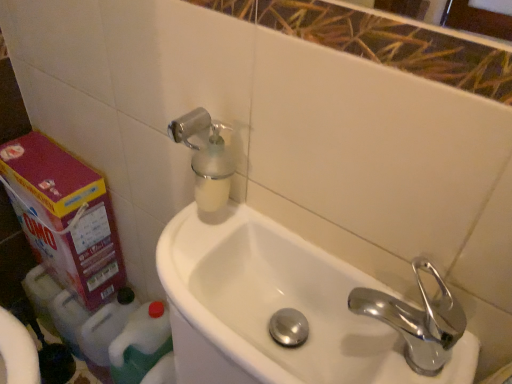
Question: Is translucent plastic soap dispenser at upper left facing away from chrome metallic faucet at right?

Choices:
 (A) no
 (B) yes

Answer: (A)

Question: Is the surface of translucent plastic soap dispenser at upper left in direct contact with chrome metallic faucet at right?

Choices:
 (A) yes
 (B) no

Answer: (B)

Question: From the image's perspective, would you say translucent plastic soap dispenser at upper left is shown under chrome metallic faucet at right?

Choices:
 (A) no
 (B) yes

Answer: (A)

Question: Is translucent plastic soap dispenser at upper left shorter than chrome metallic faucet at right?

Choices:
 (A) no
 (B) yes

Answer: (A)

Question: Is translucent plastic soap dispenser at upper left outside of chrome metallic faucet at right?

Choices:
 (A) no
 (B) yes

Answer: (B)

Question: From a real-world perspective, is translucent plastic soap dispenser at upper left below chrome metallic faucet at right?

Choices:
 (A) yes
 (B) no

Answer: (B)

Question: Could you tell me if chrome metallic faucet at right is facing pink cardboard carton at left?

Choices:
 (A) no
 (B) yes

Answer: (A)

Question: From the image's perspective, is chrome metallic faucet at right located above pink cardboard carton at left?

Choices:
 (A) yes
 (B) no

Answer: (B)

Question: Is pink cardboard carton at left a part of chrome metallic faucet at right?

Choices:
 (A) no
 (B) yes

Answer: (A)

Question: Is chrome metallic faucet at right positioned in front of pink cardboard carton at left?

Choices:
 (A) yes
 (B) no

Answer: (A)

Question: Is chrome metallic faucet at right taller than pink cardboard carton at left?

Choices:
 (A) no
 (B) yes

Answer: (A)

Question: Is chrome metallic faucet at right outside pink cardboard carton at left?

Choices:
 (A) no
 (B) yes

Answer: (B)

Question: Considering the relative sizes of chrome metallic faucet at right and white glossy sink at center in the image provided, is chrome metallic faucet at right thinner than white glossy sink at center?

Choices:
 (A) yes
 (B) no

Answer: (A)